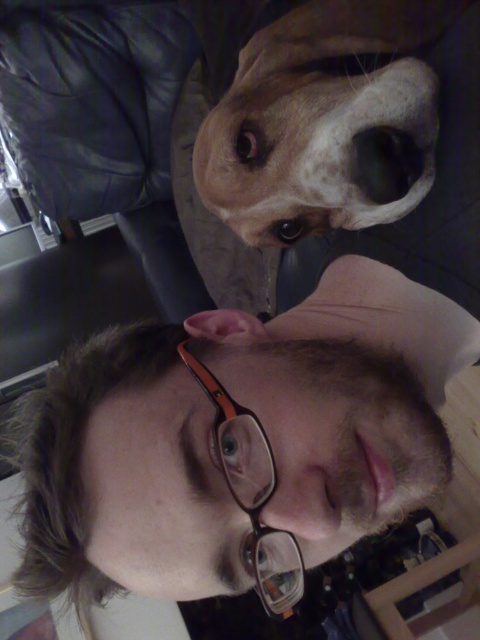
You are taking a selfie with your dog and want to ensure the camera captures both you and your dog clearly. The camera has a focal length of 50mm and an aperture of f2.8. Given that the point at coordinates (201, 468) is 42.43 centimeters away from the camera, can you determine if both you and the dog are within the camera focus range? Assume the camera focus range is 50cm to infinity.

The point at coordinates (201, 468) is 42.43 centimeters away from the camera, which is below the minimum focus distance of 50cm. Therefore, the subject at that point will be out of focus. Since the dog is positioned above the person and likely at a similar distance, both may not be in focus. Adjust your position or use a lens with a closer focus range.